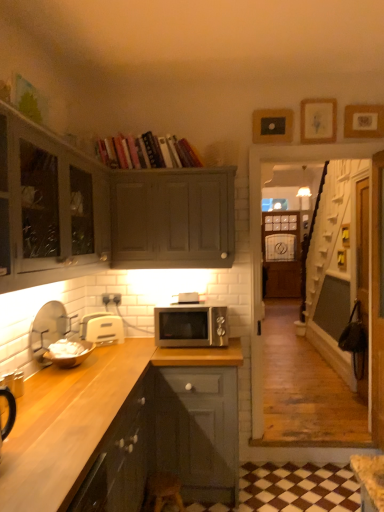
Find the location of `vacant region above dark wood countertop at lower left, placed as the third cabinetry when sorted from top to bottom (from a real-world perspective)`. vacant region above dark wood countertop at lower left, placed as the third cabinetry when sorted from top to bottom (from a real-world perspective) is located at coordinates (79, 390).